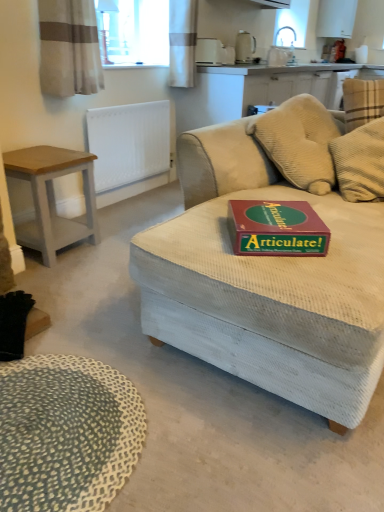
Where is `vacant space situated above textured beige mat at lower left (from a real-world perspective)`? Image resolution: width=384 pixels, height=512 pixels. vacant space situated above textured beige mat at lower left (from a real-world perspective) is located at coordinates (56, 415).